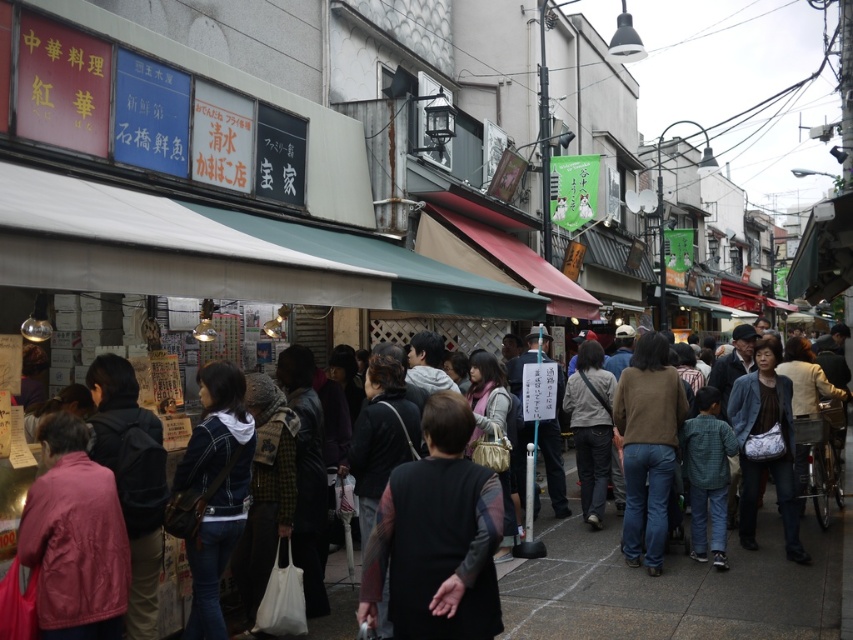
You are a person standing on the street and you see dark gray clothing at center and black fabric vest at center. Which one is more to the right?

dark gray clothing at center is to the right of black fabric vest at center.

You are a person standing on the street and you see two people wearing dark gray clothing at center and brown sweater at center. Which one is closer to the ground?

The dark gray clothing at center is below brown sweater at center, so the dark gray clothing at center is closer to the ground.